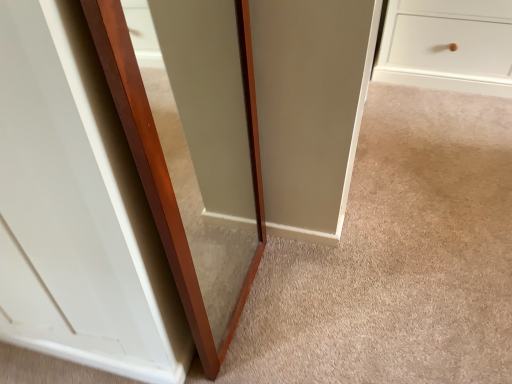
Question: Is point (79, 211) closer or farther from the camera than point (262, 236)?

Choices:
 (A) closer
 (B) farther

Answer: (A)

Question: From the image's perspective, relative to transparent glass door at center, the first glass door viewed from the right, is transparent glass door at center, placed as the second glass door when sorted from right to left, above or below?

Choices:
 (A) below
 (B) above

Answer: (B)

Question: In terms of height, does transparent glass door at center, the 1th glass door positioned from the left, look taller or shorter compared to transparent glass door at center, the first glass door viewed from the right?

Choices:
 (A) tall
 (B) short

Answer: (A)

Question: From the image's perspective, is transparent glass door at center, which is the second glass door from left to right, located above or below transparent glass door at center, the 1th glass door positioned from the left?

Choices:
 (A) above
 (B) below

Answer: (B)

Question: Is point (108, 6) positioned closer to the camera than point (138, 221)?

Choices:
 (A) closer
 (B) farther

Answer: (A)

Question: Is transparent glass door at center, which is the second glass door from left to right, inside the boundaries of transparent glass door at center, the 1th glass door positioned from the left, or outside?

Choices:
 (A) outside
 (B) inside

Answer: (A)

Question: Is transparent glass door at center, which is the second glass door from left to right, wider or thinner than transparent glass door at center, the 1th glass door positioned from the left?

Choices:
 (A) wide
 (B) thin

Answer: (B)